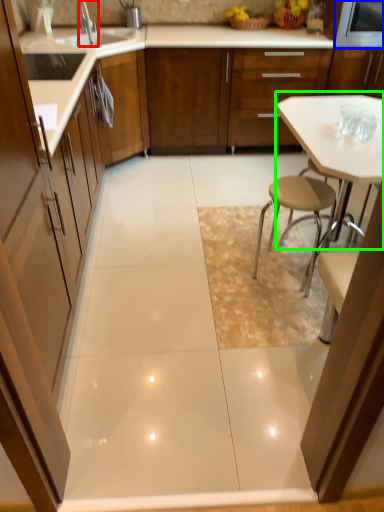
Question: Based on their relative distances, which object is nearer to tap (highlighted by a red box)? Choose from appliance (highlighted by a blue box) and table (highlighted by a green box).

Choices:
 (A) appliance
 (B) table

Answer: (B)